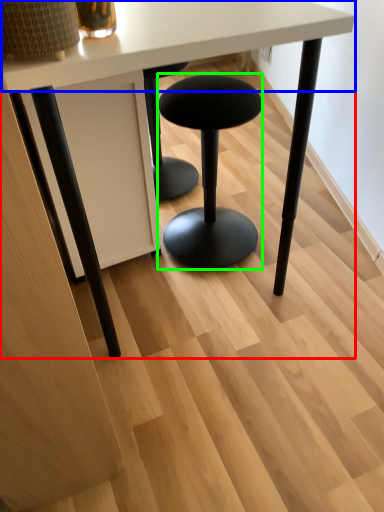
Question: Considering the real-world distances, which object is farthest from table (highlighted by a red box)? round table (highlighted by a blue box) or stool (highlighted by a green box)?

Choices:
 (A) round table
 (B) stool

Answer: (B)